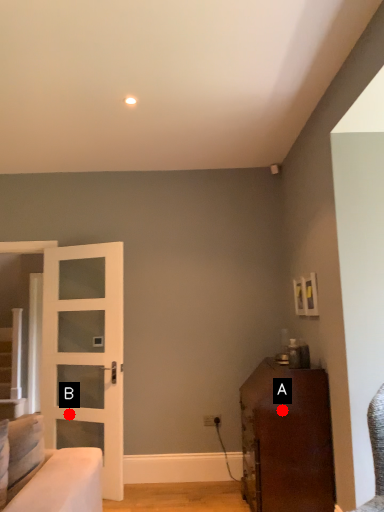
Question: Two points are circled on the image, labeled by A and B beside each circle. Which point appears farthest from the camera in this image?

Choices:
 (A) A is further
 (B) B is further

Answer: (B)